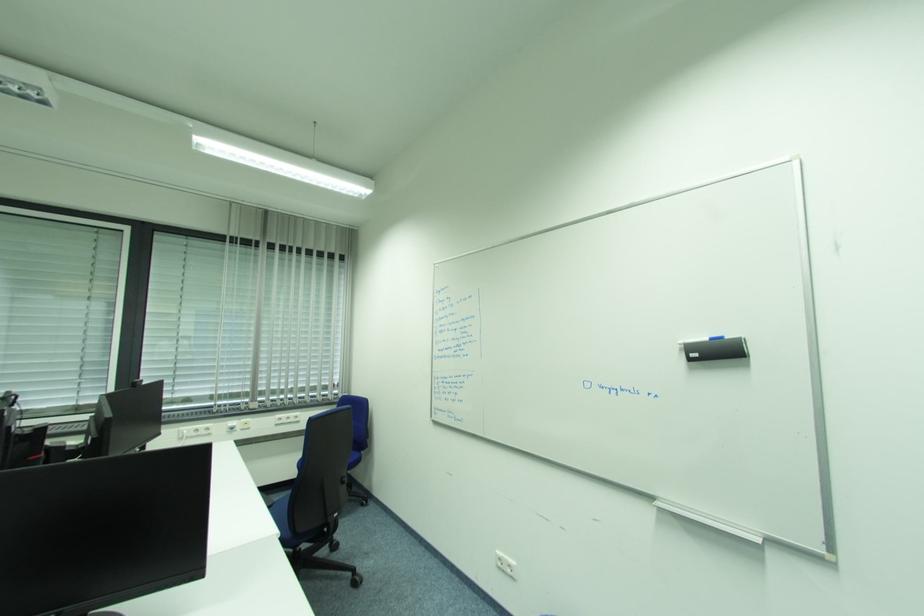
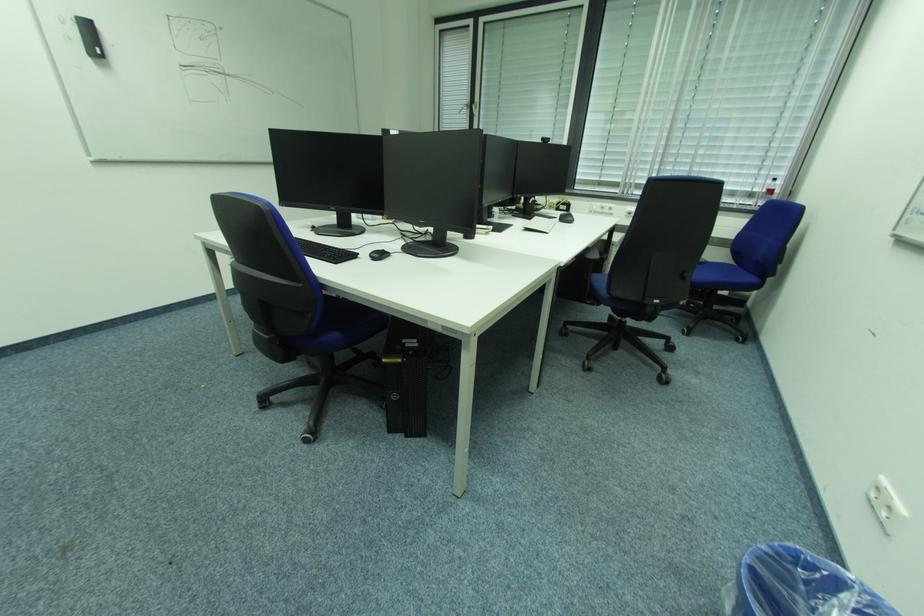
The first image is from the beginning of the video and the second image is from the end. How did the camera likely rotate when shooting the video?

The camera's rotation is toward left-down.